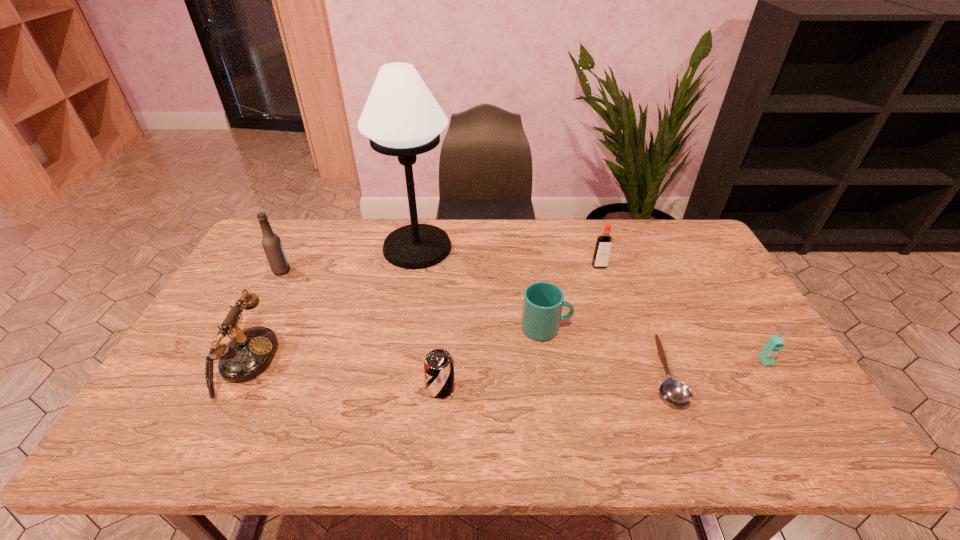
The height and width of the screenshot is (540, 960). Identify the location of table lamp. (401, 117).

The image size is (960, 540). In order to click on the seventh shortest object in this screenshot , I will do `click(272, 245)`.

The height and width of the screenshot is (540, 960). In order to click on the third object from right to left in this screenshot , I will do `click(603, 247)`.

Find the location of a particular element. The height and width of the screenshot is (540, 960). telephone is located at coordinates (248, 353).

Where is `cup`? Image resolution: width=960 pixels, height=540 pixels. cup is located at coordinates (543, 302).

At what (x,y) coordinates should I click in order to perform the action: click on the rightmost object. Please return your answer as a coordinate pair (x, y). The height and width of the screenshot is (540, 960). Looking at the image, I should click on (775, 343).

Where is `soda can`? The height and width of the screenshot is (540, 960). soda can is located at coordinates (438, 366).

Image resolution: width=960 pixels, height=540 pixels. What are the coordinates of `the seventh object from left to right` in the screenshot? It's located at (675, 392).

The height and width of the screenshot is (540, 960). I want to click on ladle, so click(675, 392).

The width and height of the screenshot is (960, 540). What are the coordinates of `vacant space located on the front of the table lamp` in the screenshot? It's located at [x=403, y=331].